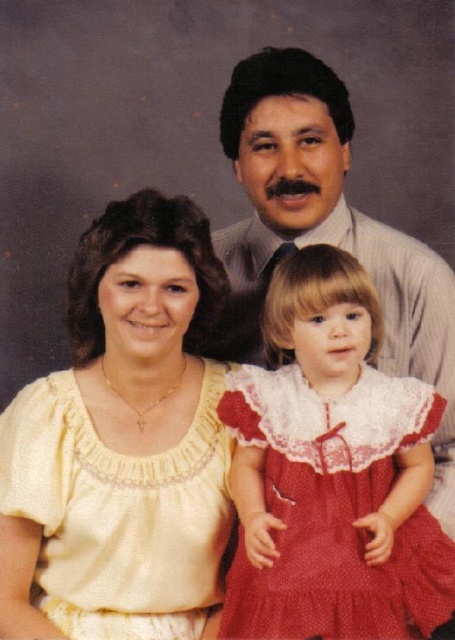
You are a photographer setting up a photo shoot. You have two outfits to choose from for the main subject. The yellow satin blouse at center and the red lace dress at center. Based on the scene description, which outfit would you recommend for a formal event and why?

The yellow satin blouse at center is larger in size than the red lace dress at center, making it more suitable for a formal event as it can accommodate a wider range of body types and provide a more structured look.

You are a photographer adjusting the focus on your camera. You need to focus on both the point at point (11, 458) and the point at point (319, 573). Which point should you focus on first to ensure both are in focus?

You should focus on point (11, 458) first because it is closer to the camera than point (319, 573). By focusing on the closer point, the farther point will also be in focus if they are within the depth of field range.

You are an artist trying to recreate this family portrait. You want to place the yellow satin blouse at center exactly where it appears in the original image. What are the coordinates you should use for its position?

The coordinates for the yellow satin blouse at center should be set at point (x=121, y=429) to match its original position in the image.